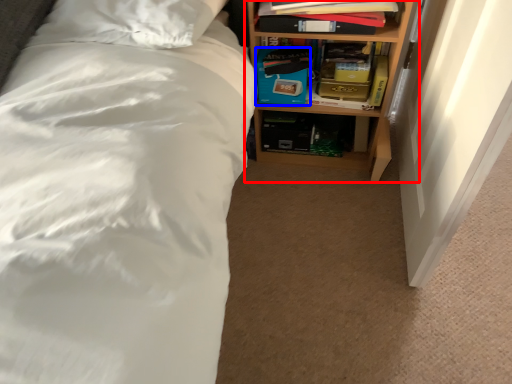
Question: Among these objects, which one is farthest to the camera, shelf (highlighted by a red box) or box (highlighted by a blue box)?

Choices:
 (A) shelf
 (B) box

Answer: (B)